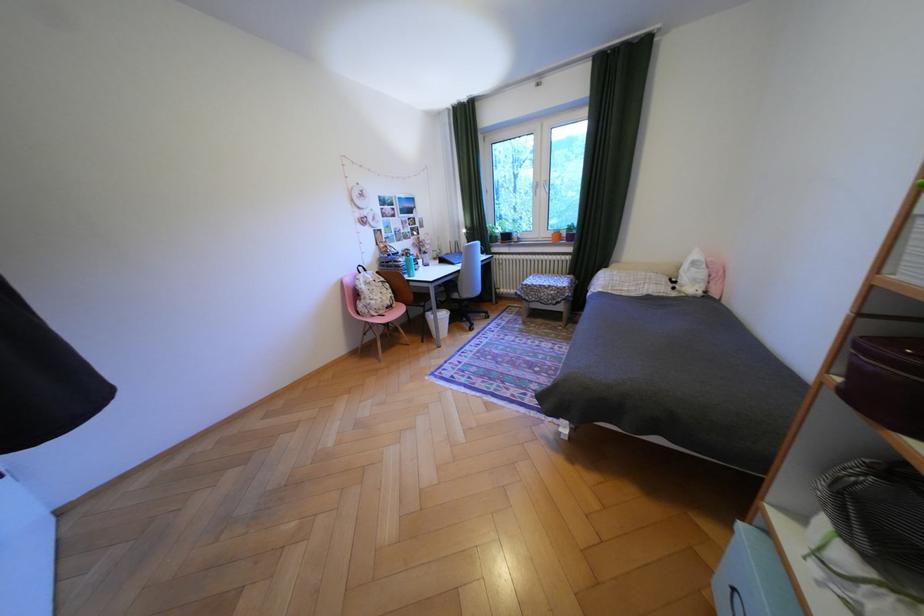
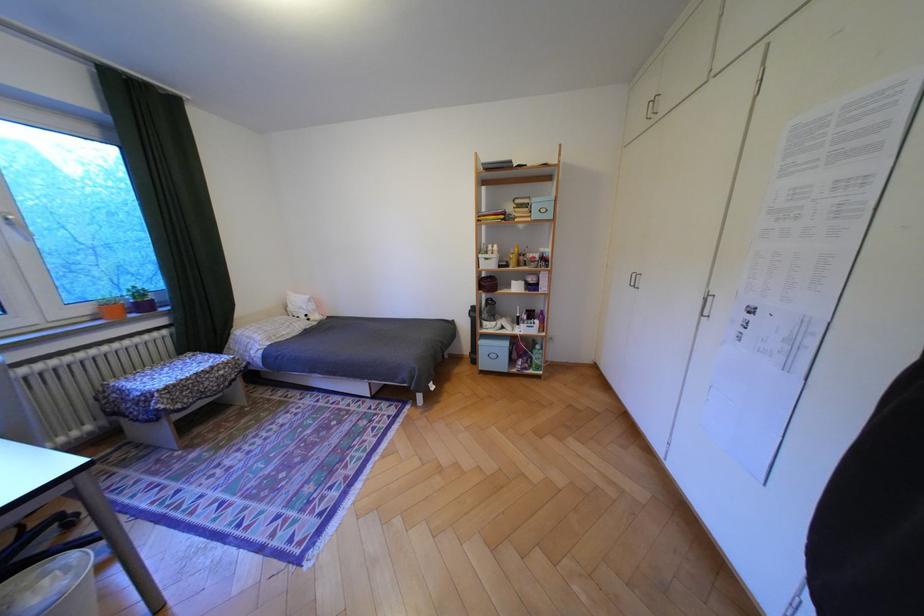
The point at (x=562, y=233) is marked in the first image. Where is the corresponding point in the second image?

(99, 310)